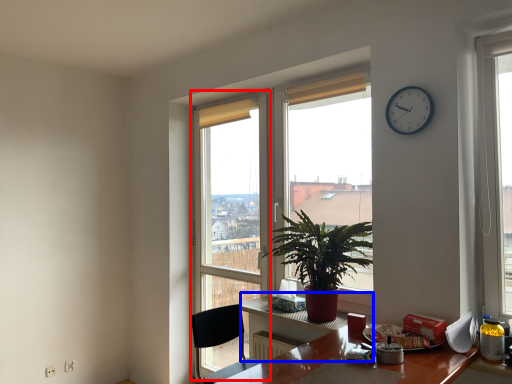
Question: Which of the following is the farthest to the observer, glass door (highlighted by a red box) or computer desk (highlighted by a blue box)?

Choices:
 (A) glass door
 (B) computer desk

Answer: (A)